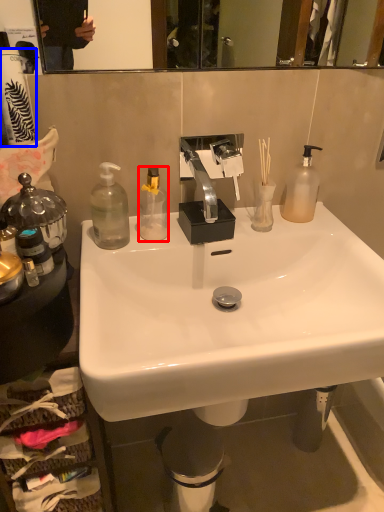
Question: Which point is closer to the camera, bottle (highlighted by a red box) or toilet paper (highlighted by a blue box)?

Choices:
 (A) bottle
 (B) toilet paper

Answer: (B)